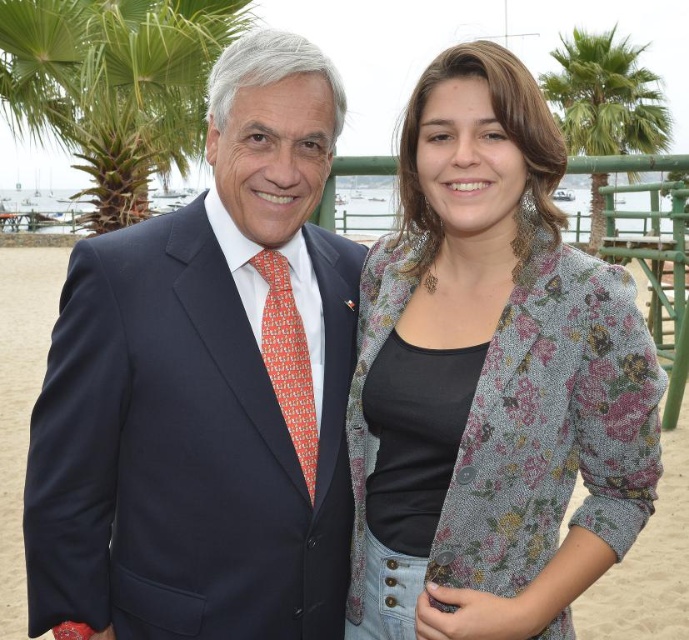
You are a photographer standing at the beach and want to take a photo of the navy blue suit at center and the green leafy palm tree at upper right in the same frame. The camera you have can capture objects up to 20 meters apart. Will you be able to include both in the photo?

The navy blue suit at center and the green leafy palm tree at upper right are 22.83 meters apart from each other, which exceeds the camera range of 20 meters. Therefore, you cannot include both in the same photo.

You are standing at the beach and want to reach the point marked as point (415, 376). If you take a step forward, how far will you be from that point?

The point (415, 376) is 16.65 feet away from the viewer. After taking a step forward, you would be 16.65 feet minus the length of your step away from the point.

You are a photographer trying to capture a photo of the navy blue suit at center and the green leafy palm tree at upper right. Based on their positions, which object is located to the left of the other?

The navy blue suit at center is positioned on the left side of green leafy palm tree at upper right.